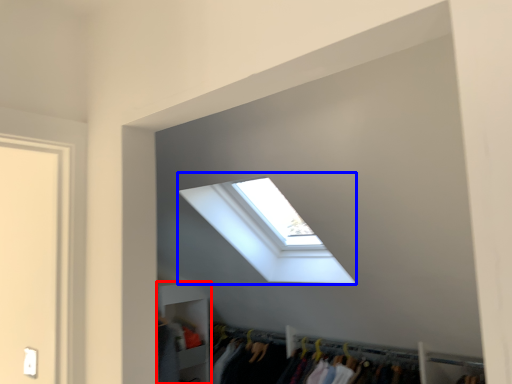
Question: Which object is closer to the camera taking this photo, shelf (highlighted by a red box) or window (highlighted by a blue box)?

Choices:
 (A) shelf
 (B) window

Answer: (B)